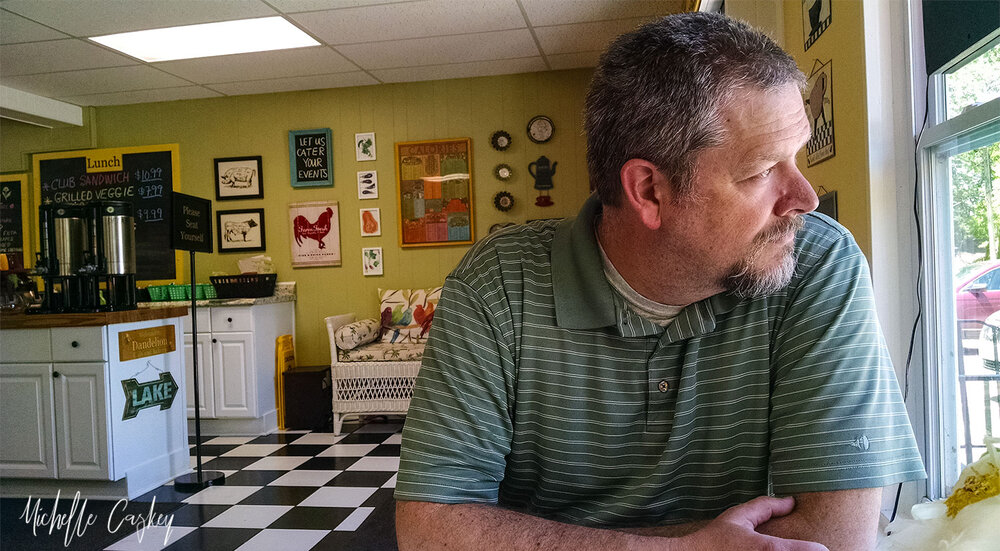
Where is `window`? The width and height of the screenshot is (1000, 551). window is located at coordinates (977, 304).